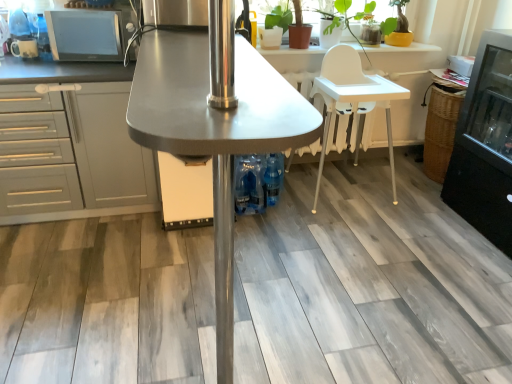
The image size is (512, 384). Find the location of `vacant space in metallic gray table at center, the 1th table viewed from the front (from a real-world perspective)`. vacant space in metallic gray table at center, the 1th table viewed from the front (from a real-world perspective) is located at coordinates (206, 311).